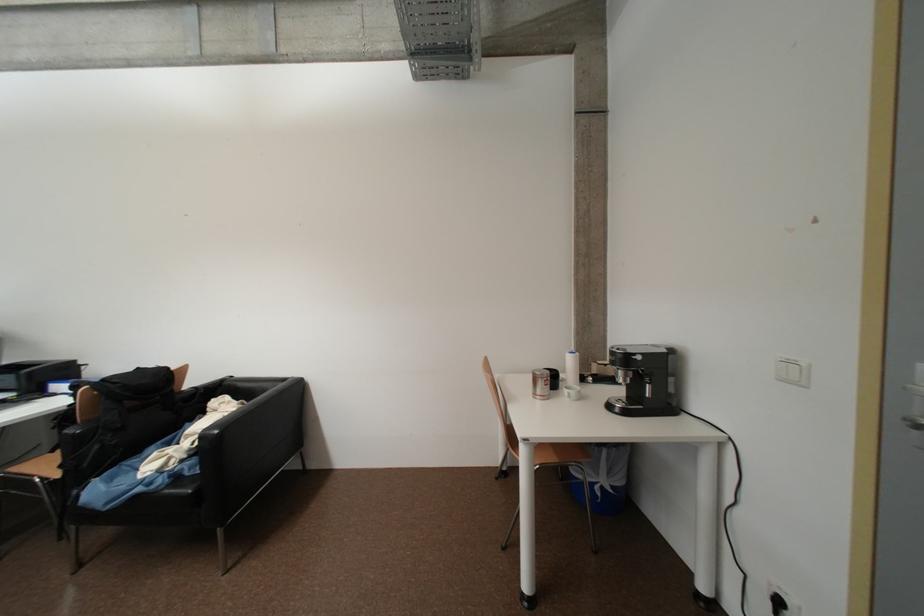
Image resolution: width=924 pixels, height=616 pixels. Describe the element at coordinates (913, 422) in the screenshot. I see `a silver door handle` at that location.